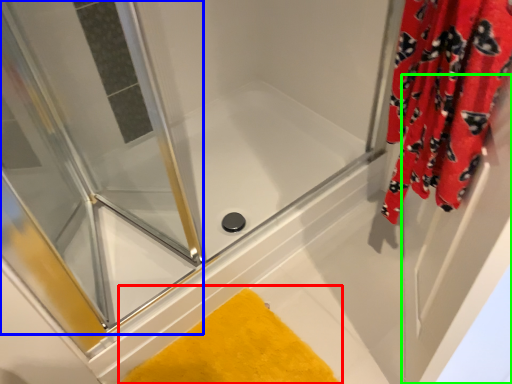
Question: Estimate the real-world distances between objects in this image. Which object is closer to bath mat (highlighted by a red box), screen door (highlighted by a blue box) or screen door (highlighted by a green box)?

Choices:
 (A) screen door
 (B) screen door

Answer: (B)